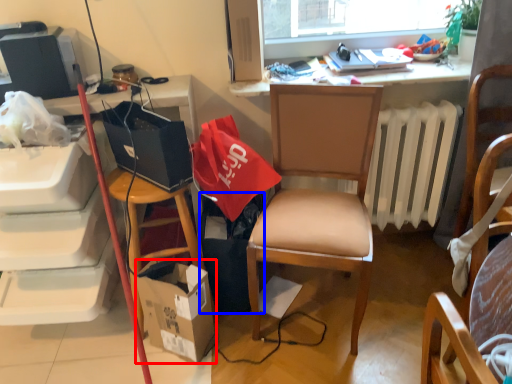
Question: Which of the following is the farthest to the observer, box (highlighted by a red box) or trash bin/can (highlighted by a blue box)?

Choices:
 (A) box
 (B) trash bin/can

Answer: (B)